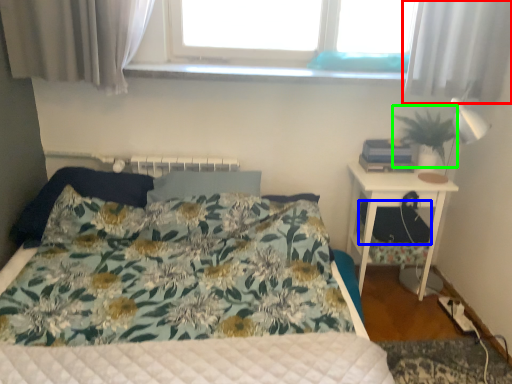
Question: Estimate the real-world distances between objects in this image. Which object is closer to curtain (highlighted by a red box), footrest (highlighted by a blue box) or plant (highlighted by a green box)?

Choices:
 (A) footrest
 (B) plant

Answer: (B)